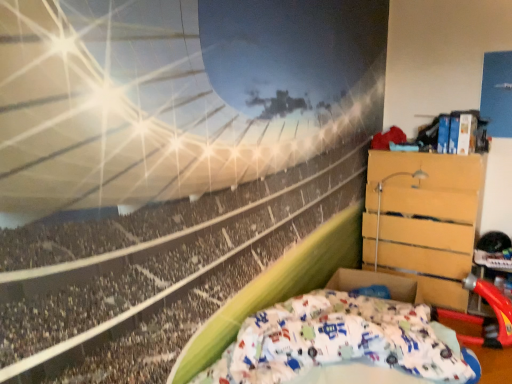
In order to face white cotton bed at lower right, should I rotate leftwards or rightwards?

A 13.003 degree turn to the right will do.

This screenshot has height=384, width=512. Find the location of `white cotton bed at lower right`. white cotton bed at lower right is located at coordinates (339, 341).

Describe the element at coordinates (339, 341) in the screenshot. I see `white cotton bed at lower right` at that location.

Describe the element at coordinates (424, 220) in the screenshot. This screenshot has height=384, width=512. I see `wooden chest of drawers at right` at that location.

In order to click on wooden chest of drawers at right in this screenshot , I will do `click(424, 220)`.

Locate an element on the screen. This screenshot has width=512, height=384. white cotton bed at lower right is located at coordinates (339, 341).

Considering the positions of objects wooden chest of drawers at right and white cotton bed at lower right in the image provided, who is more to the right, wooden chest of drawers at right or white cotton bed at lower right?

From the viewer's perspective, wooden chest of drawers at right appears more on the right side.

Which object is further away from the camera taking this photo, wooden chest of drawers at right or white cotton bed at lower right?

wooden chest of drawers at right is behind.

Is point (382, 245) farther from camera compared to point (313, 328)?

Yes, it is behind point (313, 328).

From the image's perspective, who appears lower, wooden chest of drawers at right or white cotton bed at lower right?

white cotton bed at lower right, from the image's perspective.

From a real-world perspective, is wooden chest of drawers at right under white cotton bed at lower right?

No, from a real-world perspective, wooden chest of drawers at right is not below white cotton bed at lower right.

Looking at this image, between wooden chest of drawers at right and white cotton bed at lower right, which one has larger width?

white cotton bed at lower right is wider.

Is wooden chest of drawers at right taller or shorter than white cotton bed at lower right?

Clearly, wooden chest of drawers at right is taller compared to white cotton bed at lower right.

Between wooden chest of drawers at right and white cotton bed at lower right, which one has larger size?

wooden chest of drawers at right.

Which is correct: wooden chest of drawers at right is inside white cotton bed at lower right, or outside of it?

wooden chest of drawers at right is not inside white cotton bed at lower right, it's outside.

Would you consider wooden chest of drawers at right to be distant from white cotton bed at lower right?

wooden chest of drawers at right is far away from white cotton bed at lower right.

Is wooden chest of drawers at right looking in the opposite direction of white cotton bed at lower right?

No, wooden chest of drawers at right is not facing away from white cotton bed at lower right.

Can you tell me how much wooden chest of drawers at right and white cotton bed at lower right differ in facing direction?

The angle between the facing direction of wooden chest of drawers at right and the facing direction of white cotton bed at lower right is 90 degrees.

How far apart are wooden chest of drawers at right and white cotton bed at lower right?

They are 3.68 feet apart.

In the image, there is a white cotton bed at lower right. Where is `furniture above it (from the image's perspective)`? The image size is (512, 384). furniture above it (from the image's perspective) is located at coordinates (424, 220).

Considering the relative positions of white cotton bed at lower right and wooden chest of drawers at right in the image provided, is white cotton bed at lower right to the left of wooden chest of drawers at right from the viewer's perspective?

Indeed, white cotton bed at lower right is positioned on the left side of wooden chest of drawers at right.

Which is in front, white cotton bed at lower right or wooden chest of drawers at right?

white cotton bed at lower right.

Is point (453, 355) more distant than point (461, 206)?

No.

From the image's perspective, which one is positioned lower, white cotton bed at lower right or wooden chest of drawers at right?

white cotton bed at lower right is shown below in the image.

From a real-world perspective, is white cotton bed at lower right physically above wooden chest of drawers at right?

No, from a real-world perspective, white cotton bed at lower right is not over wooden chest of drawers at right

Which object is wider, white cotton bed at lower right or wooden chest of drawers at right?

Wider between the two is white cotton bed at lower right.

Consider the image. Which of these two, white cotton bed at lower right or wooden chest of drawers at right, stands shorter?

white cotton bed at lower right.

Does white cotton bed at lower right have a smaller size compared to wooden chest of drawers at right?

Yes.

Would you say white cotton bed at lower right contains wooden chest of drawers at right?

Definitely not — wooden chest of drawers at right is not inside white cotton bed at lower right.

Based on the photo, is white cotton bed at lower right not near wooden chest of drawers at right?

white cotton bed at lower right is positioned a significant distance from wooden chest of drawers at right.

Is white cotton bed at lower right looking in the opposite direction of wooden chest of drawers at right?

white cotton bed at lower right is not turned away from wooden chest of drawers at right.

The width and height of the screenshot is (512, 384). In order to click on furniture lying behind the white cotton bed at lower right in this screenshot , I will do `click(424, 220)`.

At what (x,y) coordinates should I click in order to perform the action: click on furniture that appears above the white cotton bed at lower right (from a real-world perspective). Please return your answer as a coordinate pair (x, y). This screenshot has height=384, width=512. Looking at the image, I should click on (424, 220).

Find the location of a particular element. This screenshot has width=512, height=384. bed below the wooden chest of drawers at right (from a real-world perspective) is located at coordinates (339, 341).